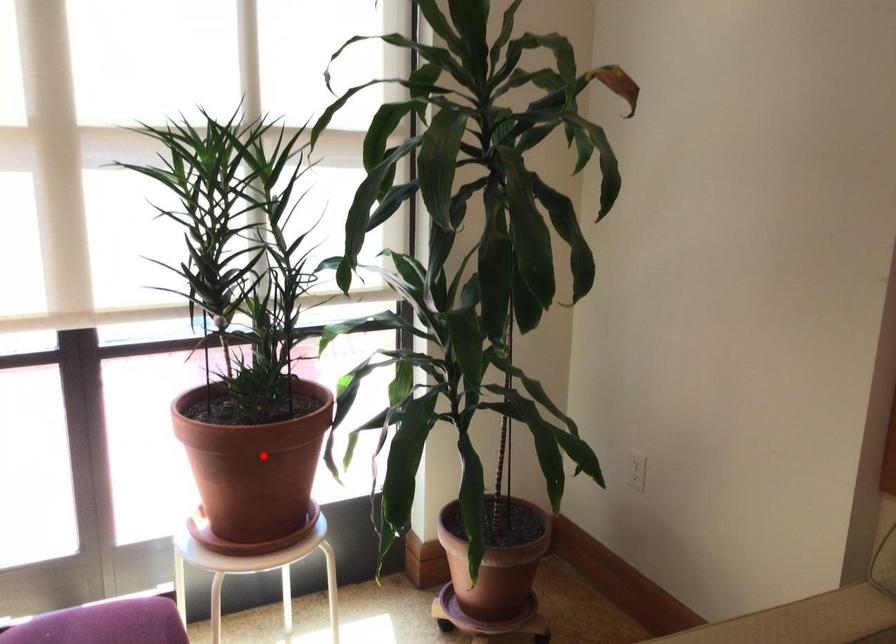
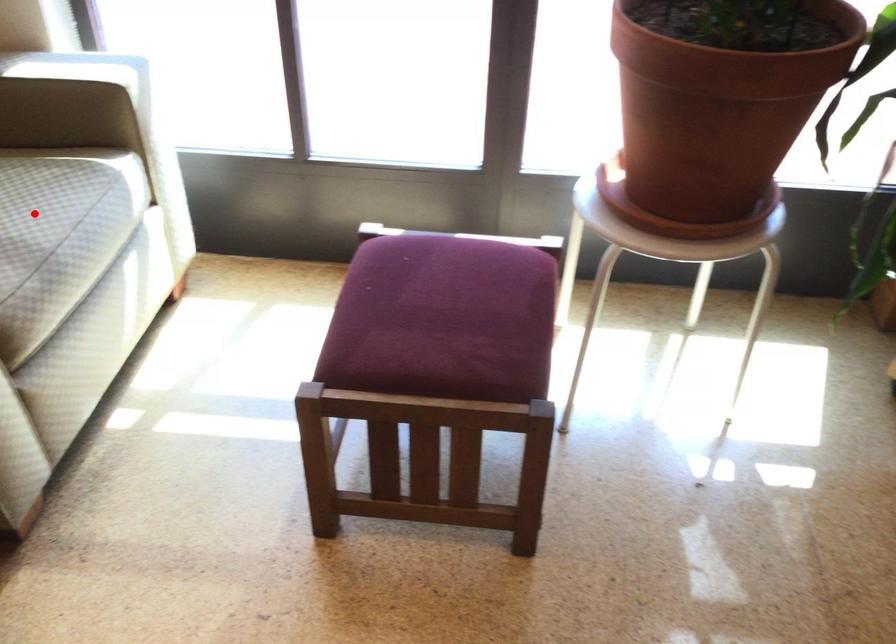
I am providing you with two images of the same scene from different viewpoints. A red point is marked on the first image and another point is marked on the second image. Is the marked point in image1 the same physical position as the marked point in image2?

No